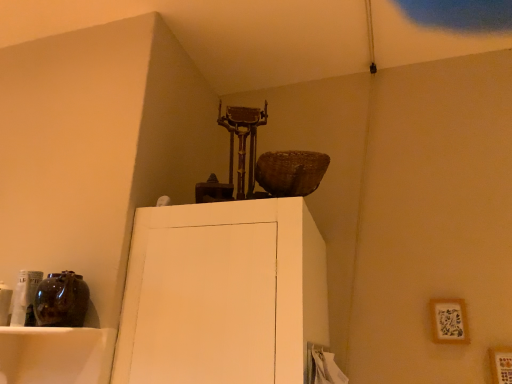
Question: Considering the relative positions of wooden picture frame at upper right, which is counted as the second picture frame, starting from the front, and wooden picture frame at lower right, which is counted as the first picture frame, starting from the front, in the image provided, is wooden picture frame at upper right, which is counted as the second picture frame, starting from the front, to the right of wooden picture frame at lower right, which is counted as the first picture frame, starting from the front, from the viewer's perspective?

Choices:
 (A) no
 (B) yes

Answer: (A)

Question: Considering the relative positions of wooden picture frame at upper right, which is counted as the second picture frame, starting from the front, and wooden picture frame at lower right, positioned as the first picture frame in right-to-left order, in the image provided, is wooden picture frame at upper right, which is counted as the second picture frame, starting from the front, behind wooden picture frame at lower right, positioned as the first picture frame in right-to-left order,?

Choices:
 (A) no
 (B) yes

Answer: (B)

Question: From a real-world perspective, is wooden picture frame at upper right, which is counted as the second picture frame, starting from the front, beneath wooden picture frame at lower right, positioned as the first picture frame in right-to-left order?

Choices:
 (A) no
 (B) yes

Answer: (A)

Question: Is wooden picture frame at upper right, the 2th picture frame ordered from the bottom, oriented towards wooden picture frame at lower right, which ranks as the second picture frame in back-to-front order?

Choices:
 (A) no
 (B) yes

Answer: (A)

Question: Does wooden picture frame at upper right, positioned as the first picture frame in left-to-right order, lie in front of wooden picture frame at lower right, marked as the second picture frame in a left-to-right arrangement?

Choices:
 (A) yes
 (B) no

Answer: (B)

Question: Is wooden picture frame at lower right, which appears as the second picture frame when viewed from the top, surrounded by wooden picture frame at upper right, which appears as the 2th picture frame when viewed from the right?

Choices:
 (A) no
 (B) yes

Answer: (A)

Question: Can you see wooden picture frame at lower right, which is counted as the first picture frame, starting from the front, touching wooden picture frame at upper right, positioned as the first picture frame in left-to-right order?

Choices:
 (A) yes
 (B) no

Answer: (B)

Question: Is wooden picture frame at lower right, which appears as the second picture frame when viewed from the top, wider than wooden picture frame at upper right, positioned as the first picture frame in left-to-right order?

Choices:
 (A) no
 (B) yes

Answer: (B)

Question: From a real-world perspective, is wooden picture frame at lower right, which is counted as the first picture frame, starting from the front, on wooden picture frame at upper right, which appears as the 2th picture frame when viewed from the right?

Choices:
 (A) yes
 (B) no

Answer: (B)

Question: Does wooden picture frame at lower right, positioned as the first picture frame in right-to-left order, have a greater height compared to wooden picture frame at upper right, which is the first picture frame from top to bottom?

Choices:
 (A) no
 (B) yes

Answer: (A)

Question: From the image's perspective, is wooden picture frame at lower right, which appears as the second picture frame when viewed from the top, located above wooden picture frame at upper right, which is counted as the second picture frame, starting from the front?

Choices:
 (A) no
 (B) yes

Answer: (A)

Question: Is wooden picture frame at lower right, which is counted as the first picture frame, starting from the front, at the right side of wooden picture frame at upper right, which is counted as the second picture frame, starting from the front?

Choices:
 (A) no
 (B) yes

Answer: (B)

Question: From the image's perspective, relative to wooden picture frame at upper right, which is the first picture frame from top to bottom, is wooden picture frame at lower right, the first picture frame ordered from the bottom, above or below?

Choices:
 (A) above
 (B) below

Answer: (B)